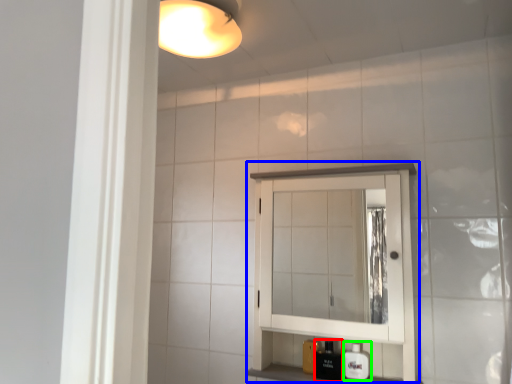
Question: Based on their relative distances, which object is farther from toiletry (highlighted by a red box)? Choose from medicine cabinet (highlighted by a blue box) and soap dispenser (highlighted by a green box).

Choices:
 (A) medicine cabinet
 (B) soap dispenser

Answer: (A)